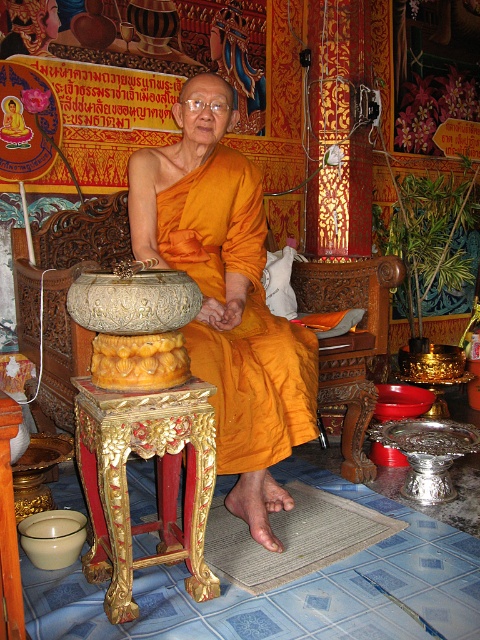
Can you confirm if matte orange robe at center is taller than carved wood chair at center?

Yes.

Is matte orange robe at center positioned before carved wood chair at center?

That is True.

Find the location of a particular element. The height and width of the screenshot is (640, 480). matte orange robe at center is located at coordinates (242, 314).